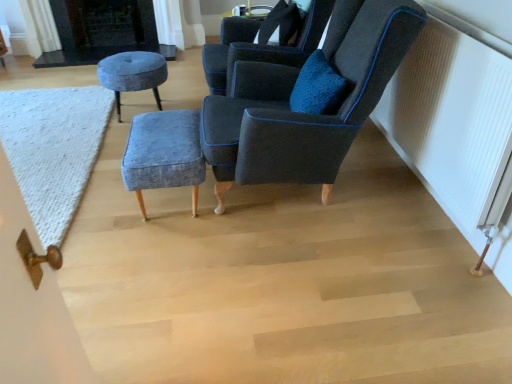
Where is `free space in front of white textured radiator at right`? The height and width of the screenshot is (384, 512). free space in front of white textured radiator at right is located at coordinates (400, 286).